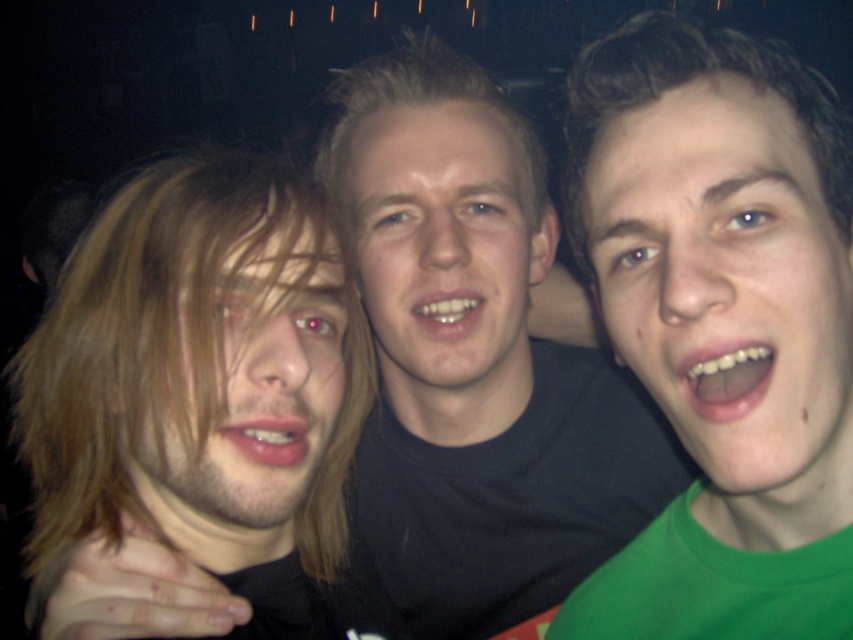
Does point (136, 234) lie behind point (650, 289)?

Yes, it is behind point (650, 289).

Measure the distance between blonde hair at left and camera.

blonde hair at left and camera are 55.96 centimeters apart from each other.

I want to click on blonde hair at left, so (202, 380).

Can you confirm if blonde hair at left is thinner than blond hair at center?

In fact, blonde hair at left might be wider than blond hair at center.

Who is positioned more to the left, blonde hair at left or blond hair at center?

blonde hair at left is more to the left.

Describe the element at coordinates (202, 380) in the screenshot. I see `blonde hair at left` at that location.

Identify the location of blonde hair at left. (202, 380).

Does point (433, 150) lie in front of point (312, 424)?

That is False.

Does point (364, 474) come in front of point (212, 512)?

No, it is not.

Locate an element on the screen. black matte shirt at center is located at coordinates tap(474, 358).